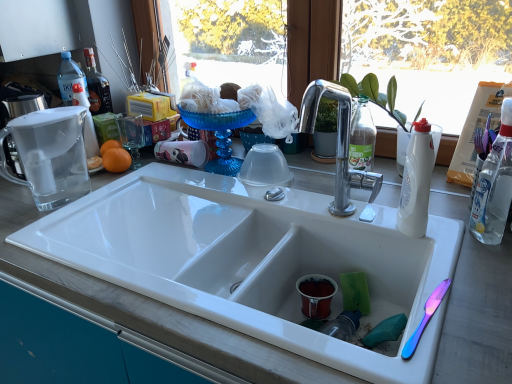
I want to click on spots to the right of white plastic bottle at right, which is counted as the second bottle, starting from the left, so click(452, 225).